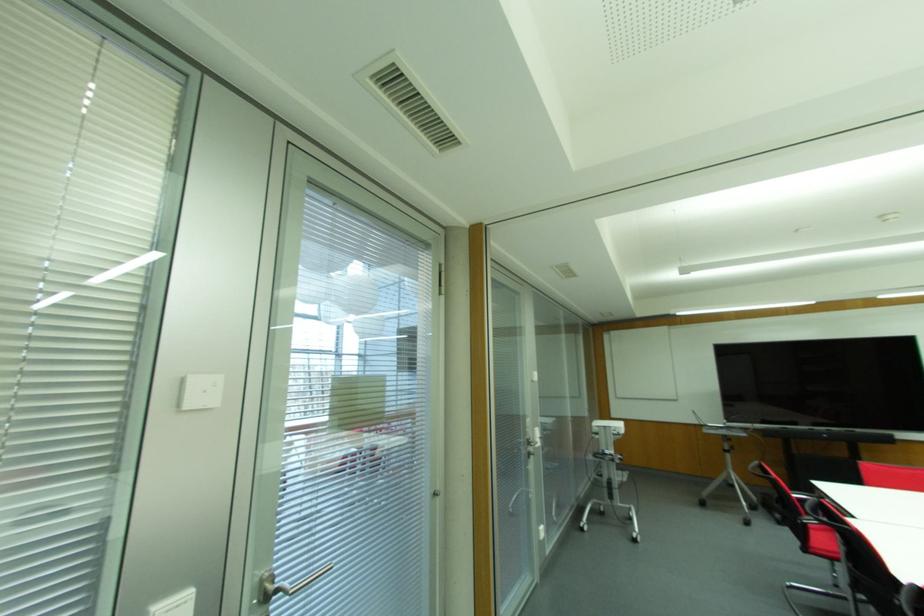
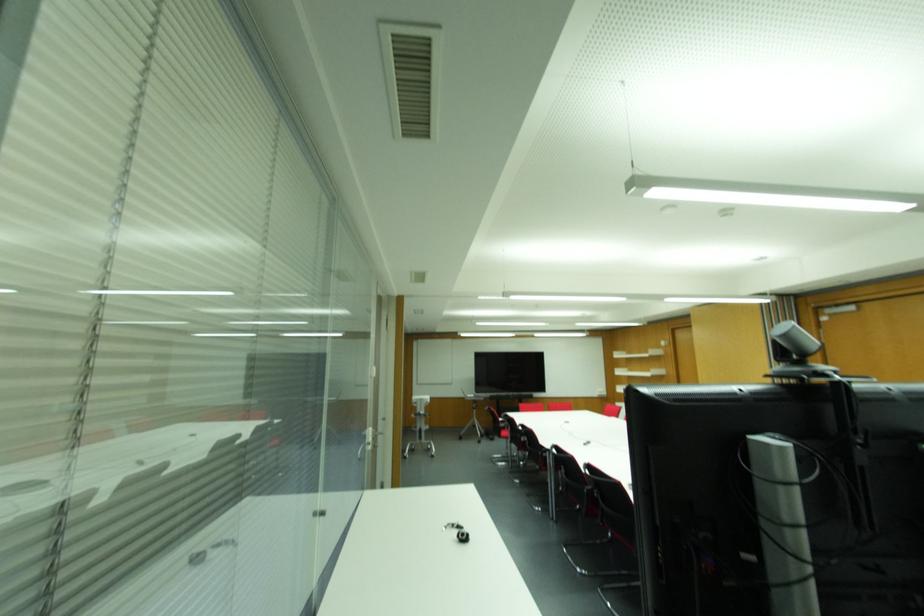
Locate, in the second image, the point that corresponds to point 727,455 in the first image.

(473, 410)